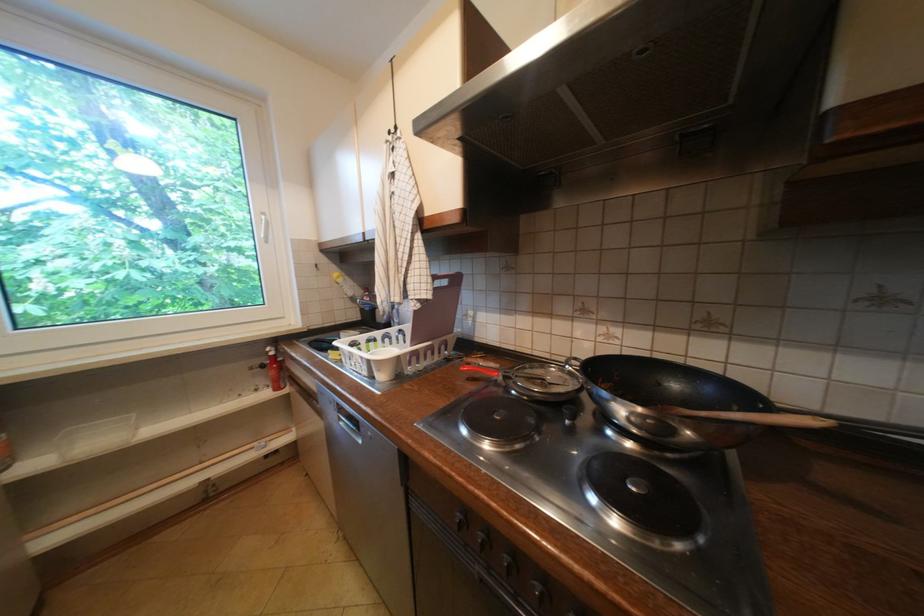
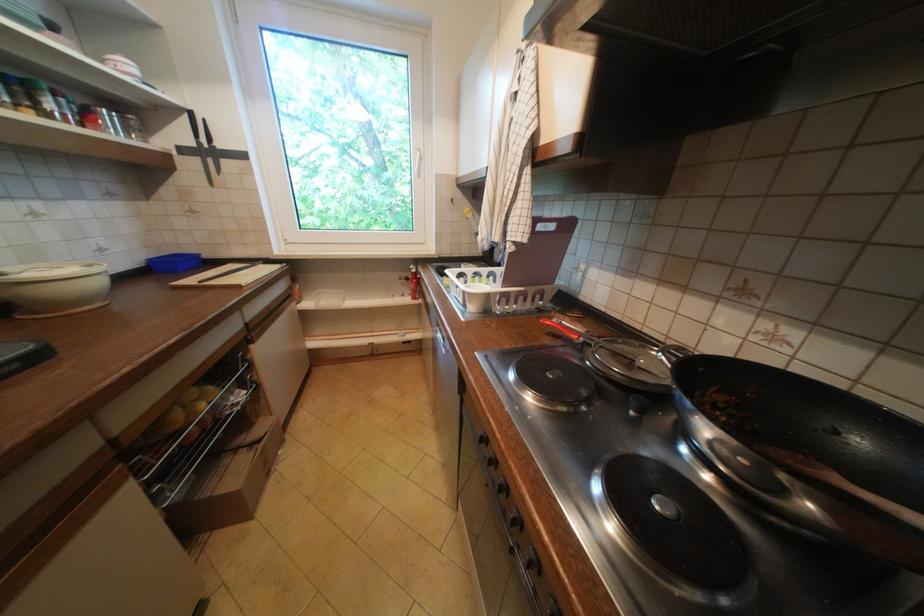
Locate, in the second image, the point that corresponds to (479,379) in the first image.

(558, 334)